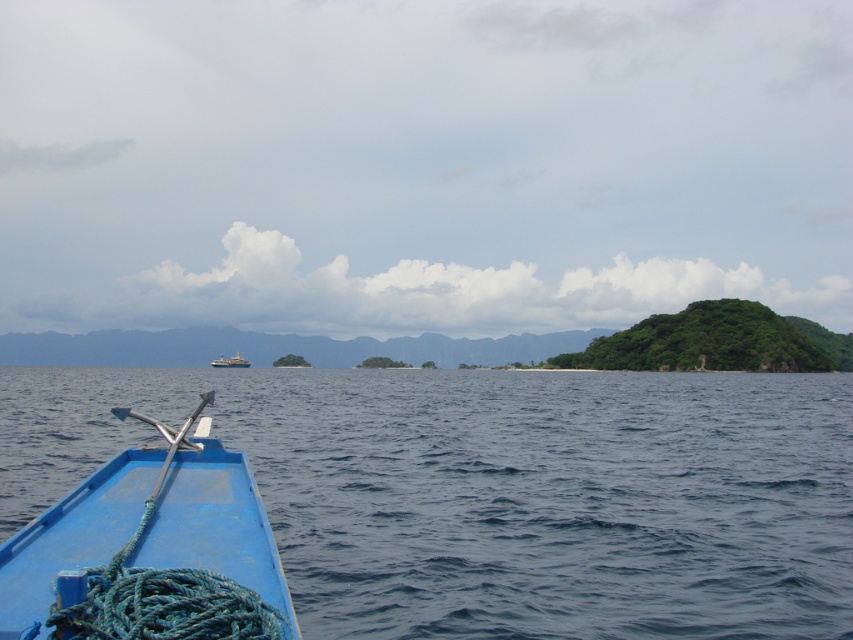
You are standing on the deck of the blue boat and want to reach the point at coordinates point (64, 612). The boat has a ladder that can extend up to 12 feet. Can you safely reach the point using the ladder?

The distance between point (64, 612) and the camera is 14.23 feet. Since the ladder can only extend up to 12 feet, it is not long enough to safely reach the point.

You are a sailor navigating a white plastic boat at center. You want to reach the green leafy island at right. Based on the distance provided, can you estimate how long it would take to reach the island if your boat travels at 5 meters per minute?

The green leafy island at right is 89.31 meters from the white plastic boat at center. At a speed of 5 meters per minute, it would take approximately 17.86 minutes to reach the island.

Looking at this image, you are navigating a boat and need to avoid obstacles. You see a green leafy island at right and a white plastic boat at center. Which object is closer to your current position?

The green leafy island at right is positioned over the white plastic boat at center, meaning it is closer to your current position.